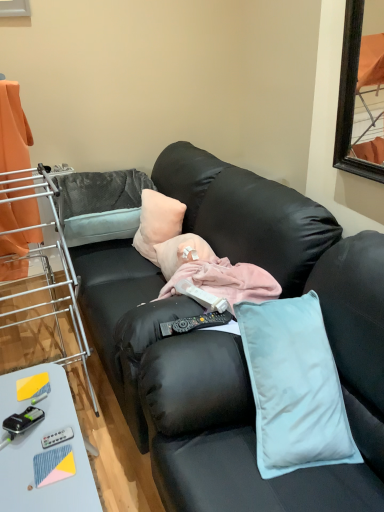
Question: Does light blue plastic table at lower left have a greater width compared to orange fabric curtain at left?

Choices:
 (A) no
 (B) yes

Answer: (B)

Question: From the image's perspective, is light blue plastic table at lower left over orange fabric curtain at left?

Choices:
 (A) no
 (B) yes

Answer: (A)

Question: Is light blue plastic table at lower left to the right of orange fabric curtain at left from the viewer's perspective?

Choices:
 (A) no
 (B) yes

Answer: (B)

Question: From a real-world perspective, is light blue plastic table at lower left under orange fabric curtain at left?

Choices:
 (A) no
 (B) yes

Answer: (B)

Question: Does light blue plastic table at lower left have a lesser height compared to orange fabric curtain at left?

Choices:
 (A) yes
 (B) no

Answer: (A)

Question: Does light blue plastic table at lower left lie in front of orange fabric curtain at left?

Choices:
 (A) yes
 (B) no

Answer: (A)

Question: Is black plastic remote control at lower left, which ranks as the second equipment in right-to-left order, at the back of black plastic remote control at center?

Choices:
 (A) yes
 (B) no

Answer: (B)

Question: From the image's perspective, is black plastic remote control at center located beneath black plastic remote control at lower left, which ranks as the second equipment in right-to-left order?

Choices:
 (A) yes
 (B) no

Answer: (B)

Question: Is the position of black plastic remote control at center more distant than that of black plastic remote control at lower left, the 1th equipment in the left-to-right sequence?

Choices:
 (A) yes
 (B) no

Answer: (A)

Question: Is black plastic remote control at center aimed at black plastic remote control at lower left, the 1th equipment in the left-to-right sequence?

Choices:
 (A) no
 (B) yes

Answer: (A)

Question: Is black plastic remote control at center in front of black plastic remote control at lower left, which ranks as the second equipment in right-to-left order?

Choices:
 (A) yes
 (B) no

Answer: (B)

Question: From the image's perspective, is black plastic remote control at center located above black plastic remote control at lower left, the 1th equipment in the left-to-right sequence?

Choices:
 (A) no
 (B) yes

Answer: (B)

Question: Considering the relative sizes of metal/brushed metal laundry rack at left and peachy soft pillow at center in the image provided, is metal/brushed metal laundry rack at left bigger than peachy soft pillow at center?

Choices:
 (A) yes
 (B) no

Answer: (A)